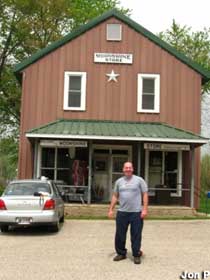
The image size is (210, 280). I want to click on wall, so click(107, 100).